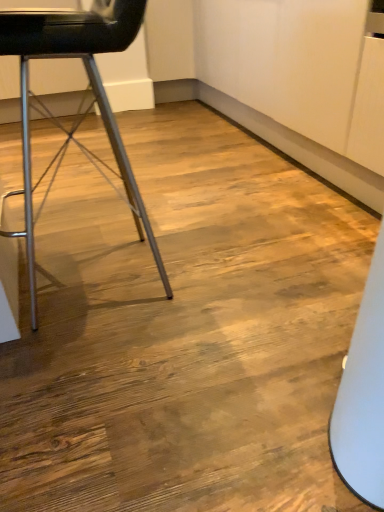
Describe the element at coordinates (87, 106) in the screenshot. I see `matte black chair at left` at that location.

Locate an element on the screen. The image size is (384, 512). matte black chair at left is located at coordinates (87, 106).

Identify the location of matte black chair at left. The width and height of the screenshot is (384, 512). (87, 106).